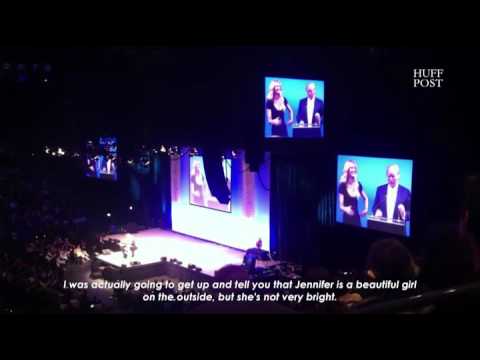
Image resolution: width=480 pixels, height=360 pixels. Find the location of `screen`. screen is located at coordinates (372, 175).